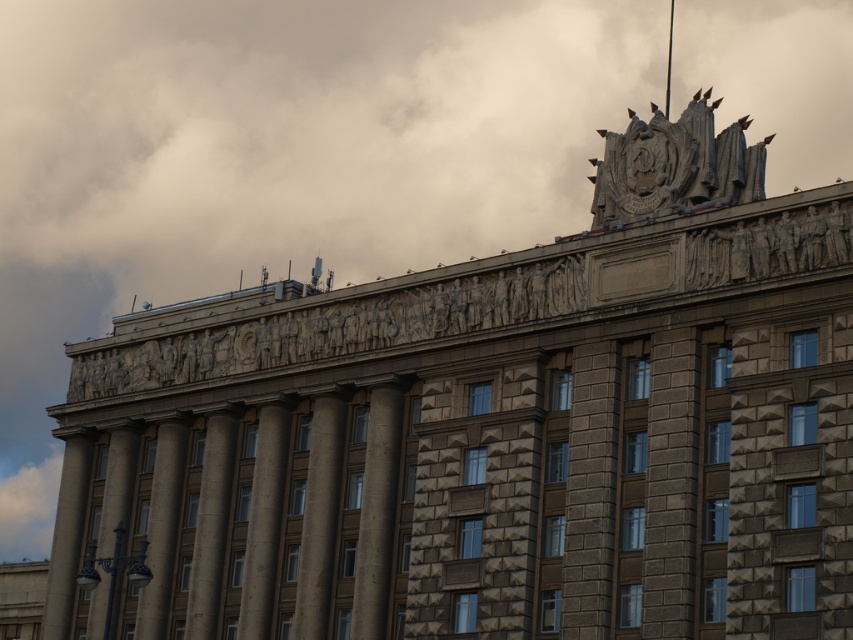
Is brown stone pillar at center to the right of gray stone column at center from the viewer's perspective?

Indeed, brown stone pillar at center is positioned on the right side of gray stone column at center.

Which is in front, point (310, 605) or point (250, 579)?

Positioned in front is point (310, 605).

Does point (314, 548) come in front of point (252, 620)?

Yes, it is in front of point (252, 620).

Image resolution: width=853 pixels, height=640 pixels. In order to click on brown stone pillar at center in this screenshot , I will do `click(318, 516)`.

Can you confirm if brown stone pillar at center is bigger than slate gray stone pillar at center?

Correct, brown stone pillar at center is larger in size than slate gray stone pillar at center.

Which of these two, brown stone pillar at center or slate gray stone pillar at center, stands taller?

With more height is brown stone pillar at center.

This screenshot has width=853, height=640. I want to click on brown stone pillar at center, so click(x=318, y=516).

In order to click on brown stone pillar at center in this screenshot , I will do `click(318, 516)`.

Which is more to the left, brown stone column at center or brown stone pillar at center?

Positioned to the left is brown stone pillar at center.

Is brown stone column at center shorter than brown stone pillar at center?

Indeed, brown stone column at center has a lesser height compared to brown stone pillar at center.

Describe the element at coordinates (376, 513) in the screenshot. I see `brown stone column at center` at that location.

Find the location of a particular element. The height and width of the screenshot is (640, 853). brown stone column at center is located at coordinates (376, 513).